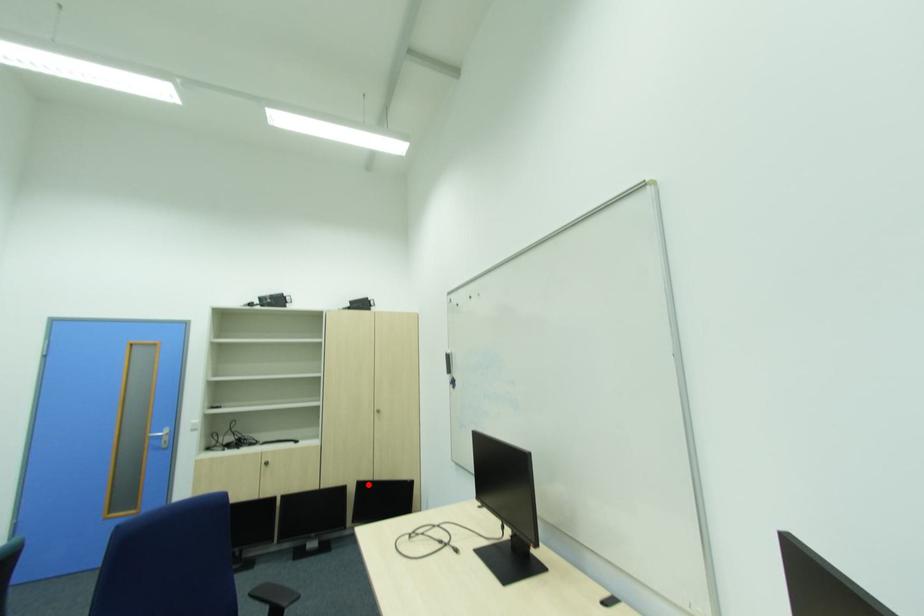
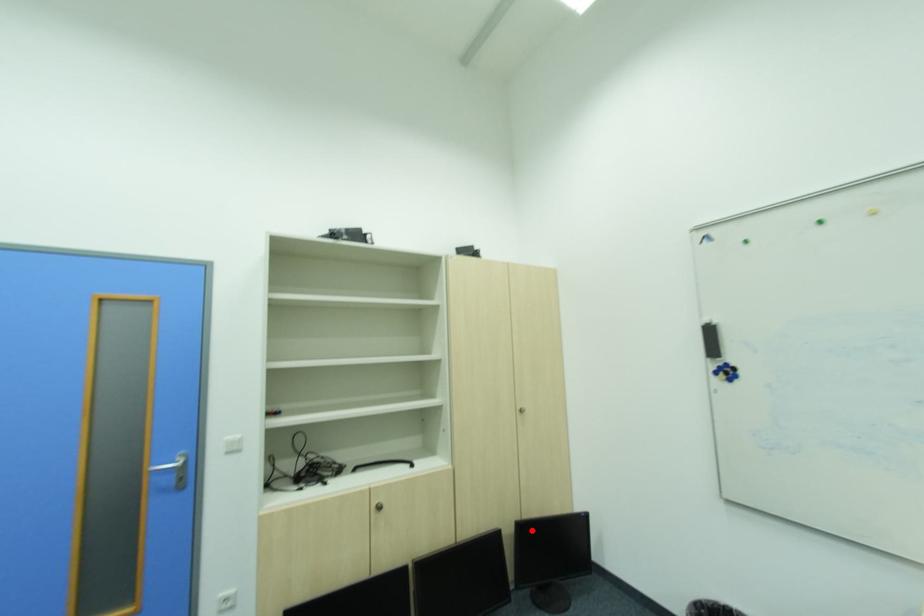
I am providing you with two images of the same scene from different viewpoints. A red point is marked on the first image and another point is marked on the second image. Is the marked point in image1 the same physical position as the marked point in image2?

Yes